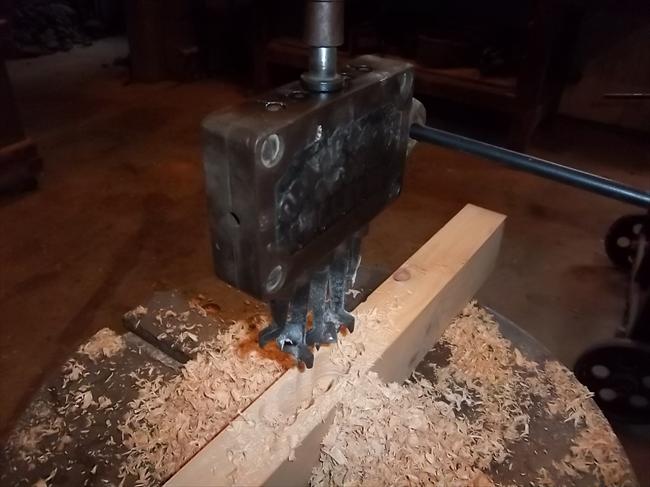
I want to click on handle, so click(541, 169).